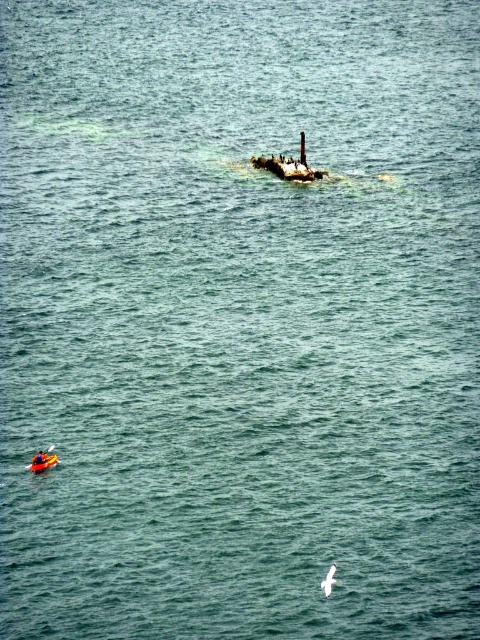
Is orange plastic kayak at center wider than white feathered bird at center?

Correct, the width of orange plastic kayak at center exceeds that of white feathered bird at center.

Does orange plastic kayak at center have a lesser height compared to white feathered bird at center?

Indeed, orange plastic kayak at center has a lesser height compared to white feathered bird at center.

Where is `orange plastic kayak at center`? orange plastic kayak at center is located at coordinates (43, 461).

You are a GUI agent. You are given a task and a screenshot of the screen. Output one action in this format:
    pyautogui.click(x=<x>, y=<y>)
    Task: Click on the orange plastic kayak at center
    This screenshot has width=480, height=640.
    Given the screenshot: What is the action you would take?
    pyautogui.click(x=43, y=461)

Is rusty metal shipwreck at center behind orange plastic kayak at center?

Yes.

Between point (276, 168) and point (46, 465), which one is positioned in front?

Point (46, 465) is in front.

Where is `rusty metal shipwreck at center`? rusty metal shipwreck at center is located at coordinates (289, 164).

Does rusty metal shipwreck at center have a lesser width compared to white feathered bird at center?

Correct, rusty metal shipwreck at center's width is less than white feathered bird at center's.

Between rusty metal shipwreck at center and white feathered bird at center, which one is positioned higher?

Positioned higher is rusty metal shipwreck at center.

In order to click on rusty metal shipwreck at center in this screenshot , I will do `click(289, 164)`.